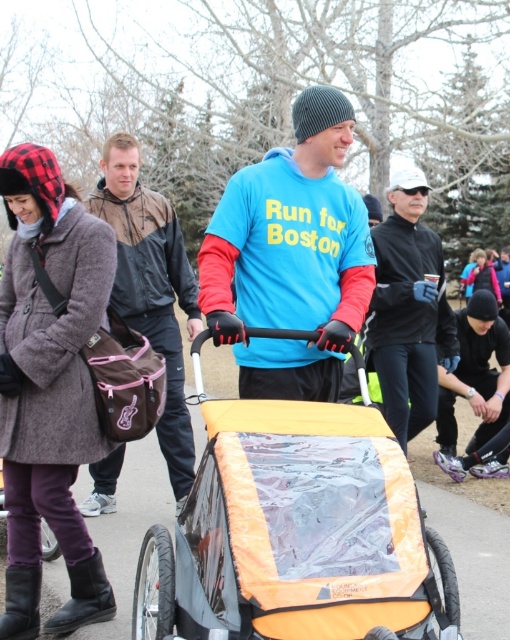
Who is more forward, (x=358, y=522) or (x=377, y=289)?

Point (x=358, y=522) is more forward.

Is point (267, 577) closer to camera compared to point (378, 259)?

Yes, it is.

Who is more distant from viewer, (x=417, y=508) or (x=388, y=301)?

The point (x=388, y=301) is more distant.

Locate an element on the screen. This screenshot has width=510, height=640. orange fabric baby carriage at center is located at coordinates (295, 532).

Does point (158, 547) come in front of point (104, 467)?

Yes, point (158, 547) is in front of point (104, 467).

Which is behind, point (371, 614) or point (144, 211)?

Point (144, 211)

Is point (267, 570) behind point (172, 401)?

No, (267, 570) is closer to viewer.

The height and width of the screenshot is (640, 510). Find the location of `orange fabric baby carriage at center`. orange fabric baby carriage at center is located at coordinates [295, 532].

Does blue matte t-shirt at center have a smaller size compared to brown fabric jacket at center?

Indeed, blue matte t-shirt at center has a smaller size compared to brown fabric jacket at center.

What do you see at coordinates (291, 257) in the screenshot? I see `blue matte t-shirt at center` at bounding box center [291, 257].

Is point (280, 204) closer to camera compared to point (161, 209)?

Yes, it is.

The width and height of the screenshot is (510, 640). In order to click on blue matte t-shirt at center in this screenshot , I will do `click(291, 257)`.